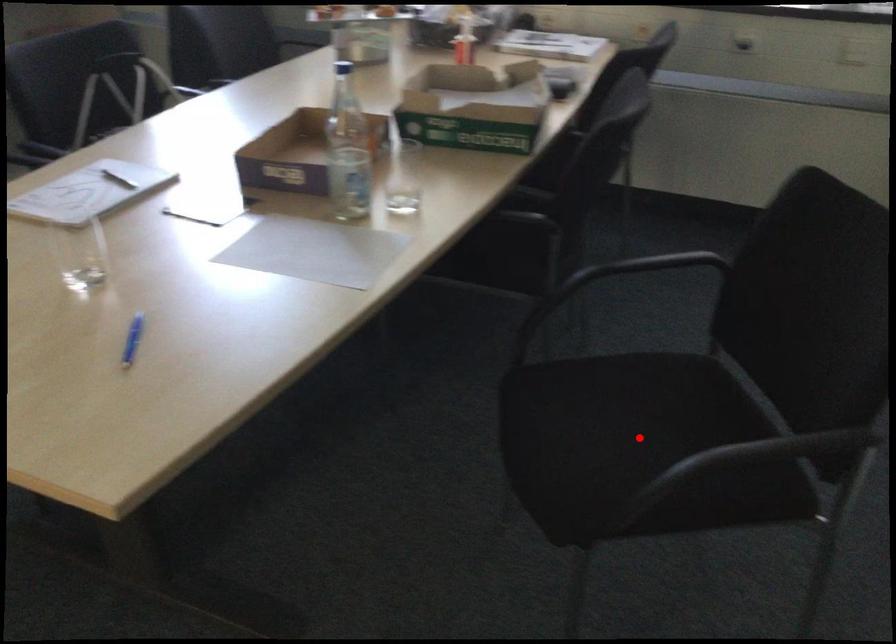
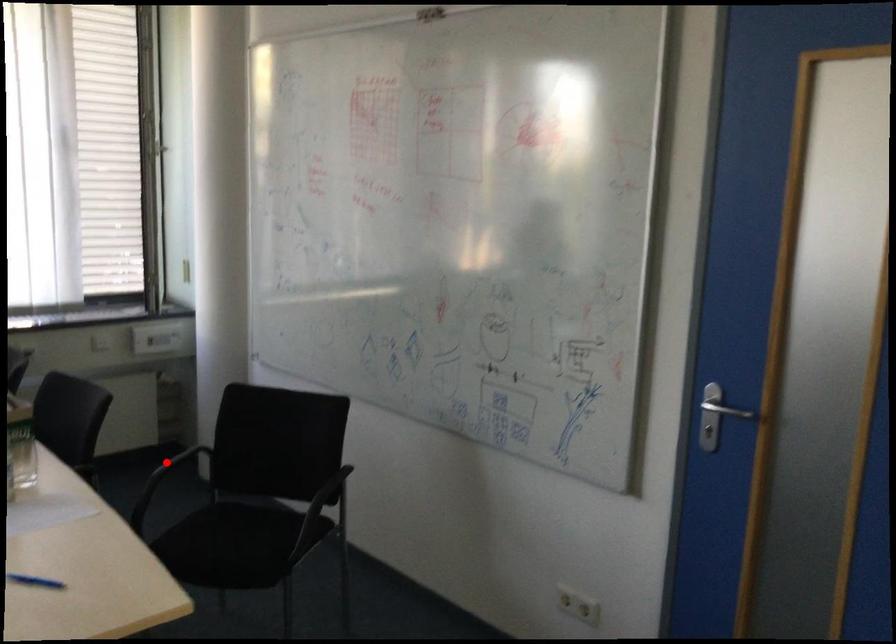
I am providing you with two images of the same scene from different viewpoints. A red point is marked on the first image and another point is marked on the second image. Is the red point in image1 aligned with the point shown in image2?

No